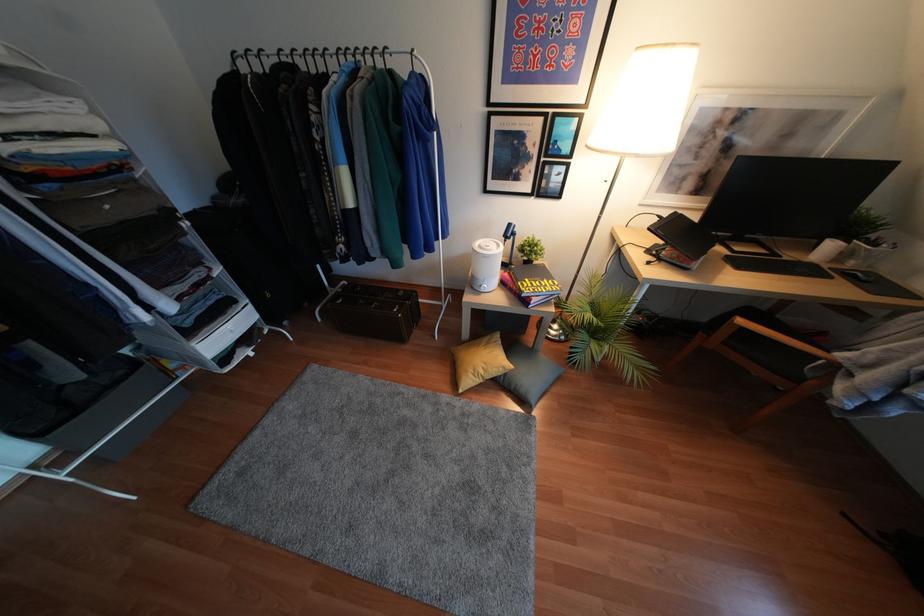
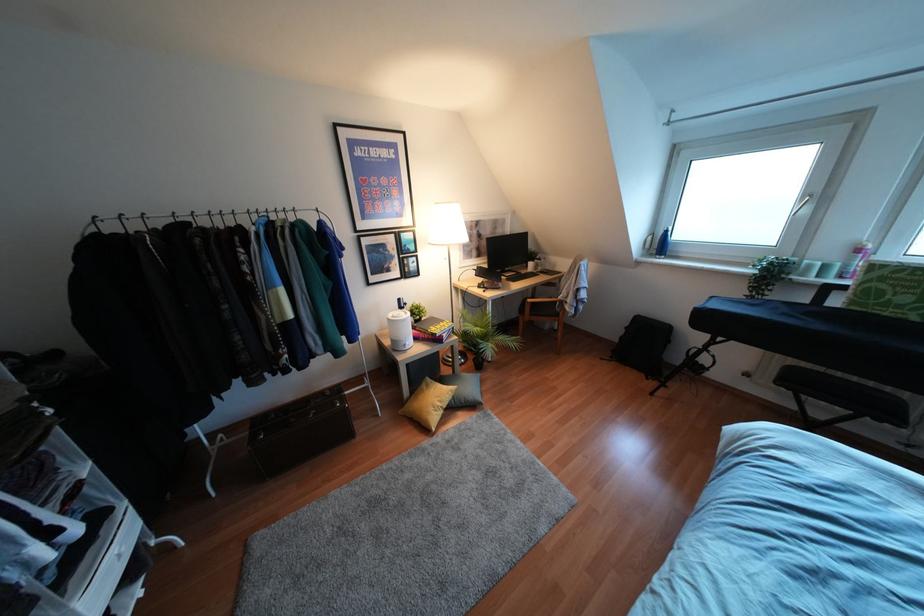
The point at (480, 371) is marked in the first image. Where is the corresponding point in the second image?

(439, 403)